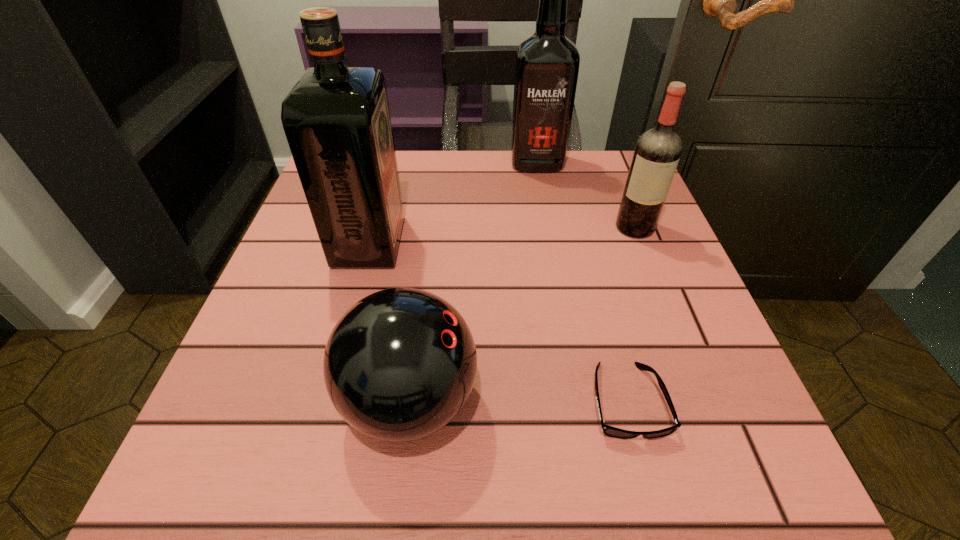
Where is `vacant space in between the bowling ball and the farthest liquor`? vacant space in between the bowling ball and the farthest liquor is located at coordinates (473, 282).

Choose which object is the third nearest neighbor to the rightmost object. Please provide its 2D coordinates. Your answer should be formatted as a tuple, i.e. [(x, y)], where the tuple contains the x and y coordinates of a point satisfying the conditions above.

[(399, 365)]

You are a GUI agent. You are given a task and a screenshot of the screen. Output one action in this format:
    pyautogui.click(x=<x>, y=<y>)
    Task: Click on the object that is the fourth closest to the rightmost object
    
    Given the screenshot: What is the action you would take?
    pyautogui.click(x=336, y=119)

I want to click on the closest liquor relative to the shortest liquor, so click(547, 64).

Locate an element on the screen. the third closest liquor relative to the shortest object is located at coordinates (547, 64).

Image resolution: width=960 pixels, height=540 pixels. I want to click on vacant space that satisfies the following two spatial constraints: 1. on the front-facing side of the farthest liquor; 2. on the front label of the leftmost liquor, so click(551, 242).

The height and width of the screenshot is (540, 960). Find the location of `free point that satisfies the following two spatial constraints: 1. on the front-facing side of the rightmost object; 2. on the front label of the leftmost liquor`. free point that satisfies the following two spatial constraints: 1. on the front-facing side of the rightmost object; 2. on the front label of the leftmost liquor is located at coordinates (640, 242).

Find the location of a particular element. The image size is (960, 540). free space that satisfies the following two spatial constraints: 1. on the front-facing side of the farthest liquor; 2. on the surface of the second shortest object near the finger holes is located at coordinates (578, 401).

This screenshot has width=960, height=540. Identify the location of vacant space that satisfies the following two spatial constraints: 1. on the front-facing side of the shortest liquor; 2. on the front label of the leftmost liquor. (640, 242).

I want to click on vacant space that satisfies the following two spatial constraints: 1. on the front-facing side of the rightmost liquor; 2. on the surface of the second shortest object near the finger holes, so click(703, 401).